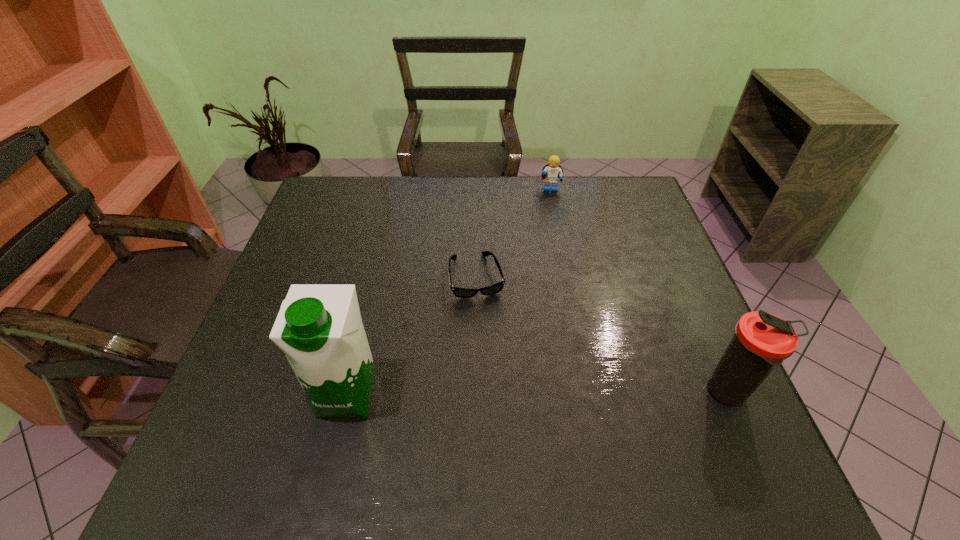
The width and height of the screenshot is (960, 540). Find the location of `free space on the desktop that is between the leftmost object and the third shortest object and is positioned on the front-facing side of the third nearest object`. free space on the desktop that is between the leftmost object and the third shortest object and is positioned on the front-facing side of the third nearest object is located at coordinates (504, 394).

Where is `free spot on the desktop that is between the leftmost object and the rightmost object and is positioned on the front-facing side of the Lego`? free spot on the desktop that is between the leftmost object and the rightmost object and is positioned on the front-facing side of the Lego is located at coordinates (543, 394).